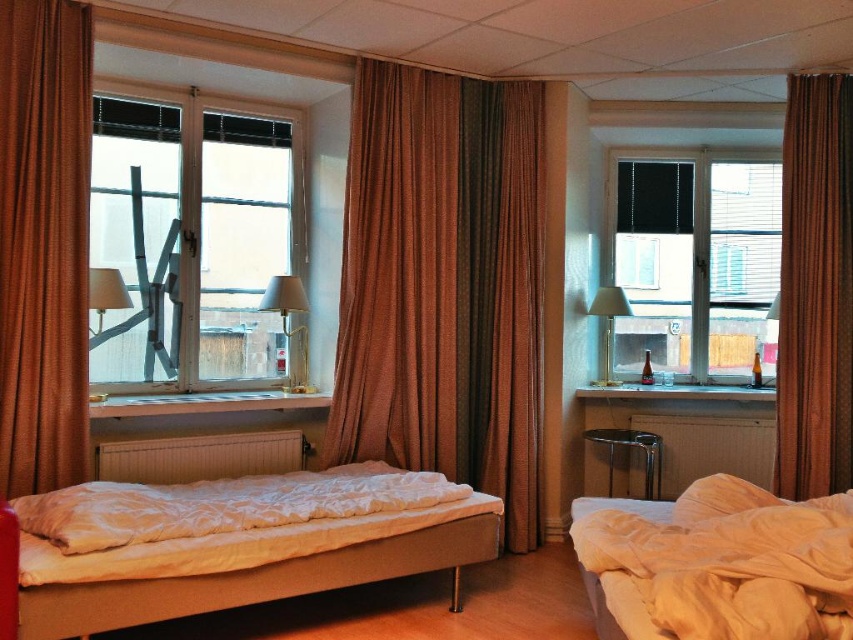
How distant is brown textured curtain at left from black fabric window at upper right?

The distance of brown textured curtain at left from black fabric window at upper right is 3.55 meters.

Between brown textured curtain at left and black fabric window at upper right, which one has more height?

brown textured curtain at left

This screenshot has height=640, width=853. I want to click on brown textured curtain at left, so click(x=44, y=243).

At what (x,y) coordinates should I click in order to perform the action: click on brown textured curtain at left. Please return your answer as a coordinate pair (x, y). Image resolution: width=853 pixels, height=640 pixels. Looking at the image, I should click on [44, 243].

Between white fabric bed at left and matte glass lamp at center, which one appears on the left side from the viewer's perspective?

Positioned to the left is matte glass lamp at center.

Which is more to the right, white fabric bed at left or matte glass lamp at center?

white fabric bed at left is more to the right.

Where is `white fabric bed at left`? white fabric bed at left is located at coordinates (252, 557).

Which is behind, point (80, 227) or point (606, 371)?

Positioned behind is point (606, 371).

Looking at this image, is the position of brown textured curtain at left less distant than that of metallic gold table lamp at right?

Yes, it is in front of metallic gold table lamp at right.

Where is `brown textured curtain at left`? brown textured curtain at left is located at coordinates (44, 243).